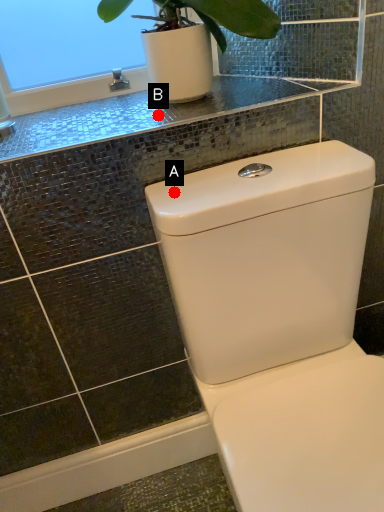
Question: Two points are circled on the image, labeled by A and B beside each circle. Which point is closer to the camera?

Choices:
 (A) A is closer
 (B) B is closer

Answer: (A)